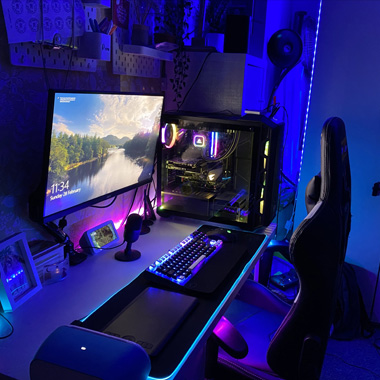
Where is `led light strip`? This screenshot has height=380, width=380. led light strip is located at coordinates (313, 66).